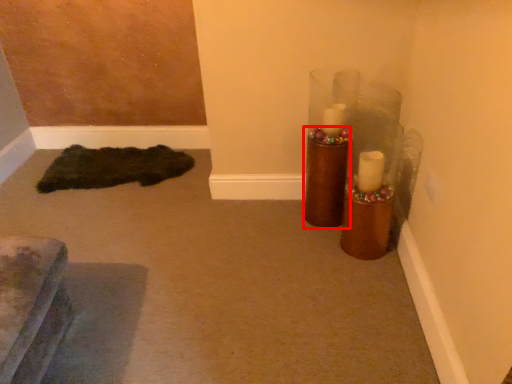
Question: From the image's perspective, considering the relative positions of candle holder (annotated by the red box) and doormat in the image provided, where is candle holder (annotated by the red box) located with respect to the staircase?

Choices:
 (A) below
 (B) above

Answer: (B)